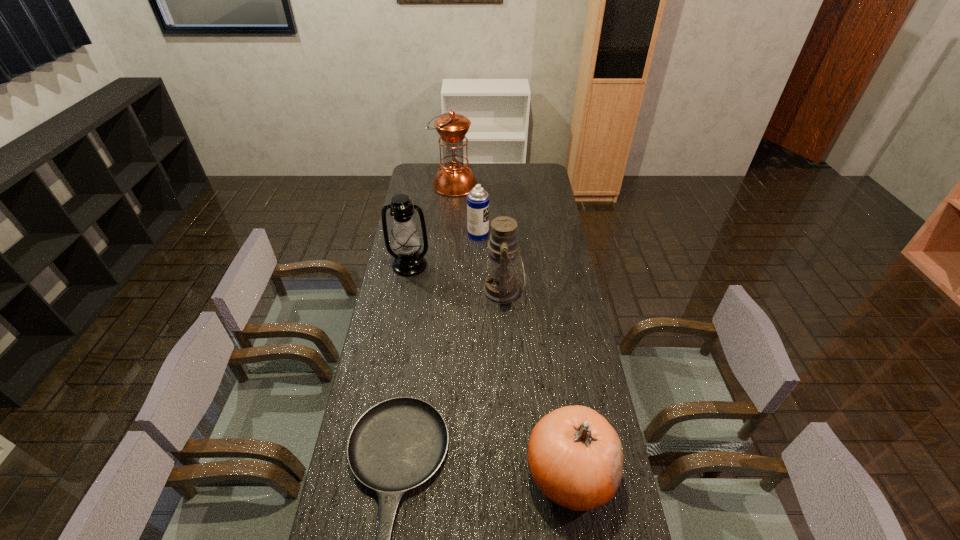
Where is `the farthest object`? The image size is (960, 540). the farthest object is located at coordinates (454, 179).

Where is `the tallest object`? the tallest object is located at coordinates (454, 179).

This screenshot has height=540, width=960. I want to click on the rightmost oil lamp, so click(x=501, y=286).

I want to click on the fifth nearest object, so click(x=477, y=199).

Locate an element on the screen. pumpkin is located at coordinates (575, 456).

Identify the location of free space located on the front of the farthest oil lamp. The image size is (960, 540). 451,224.

Locate an element on the screen. blank space located on the front of the rightmost oil lamp is located at coordinates (509, 382).

This screenshot has width=960, height=540. What are the coordinates of `vacant position located 0.250m on the label side of the aerosol can` in the screenshot? It's located at (542, 235).

Where is `free location located 0.160m on the back of the pumpkin`? This screenshot has width=960, height=540. free location located 0.160m on the back of the pumpkin is located at coordinates (557, 383).

Locate an element on the screen. The width and height of the screenshot is (960, 540). object present at the far edge is located at coordinates pyautogui.click(x=454, y=179).